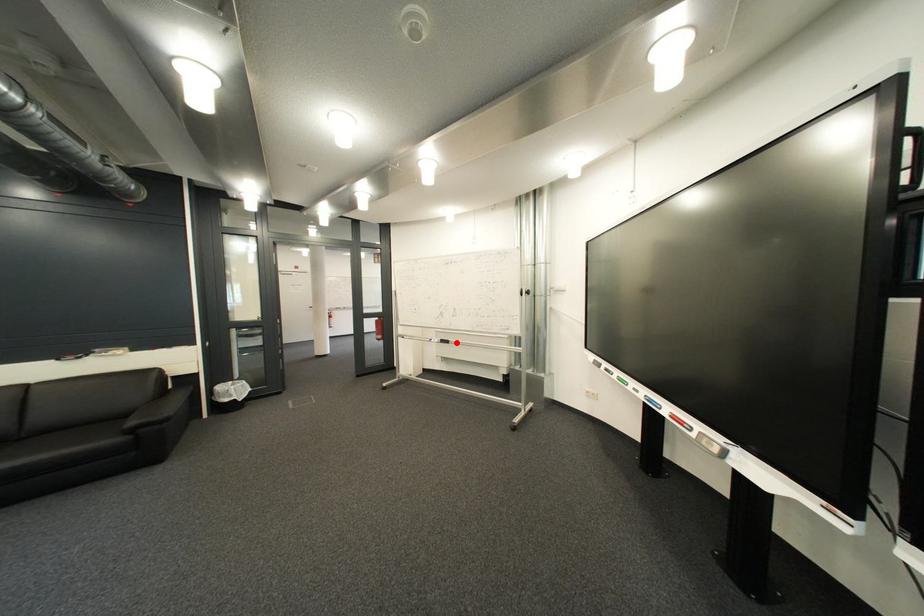
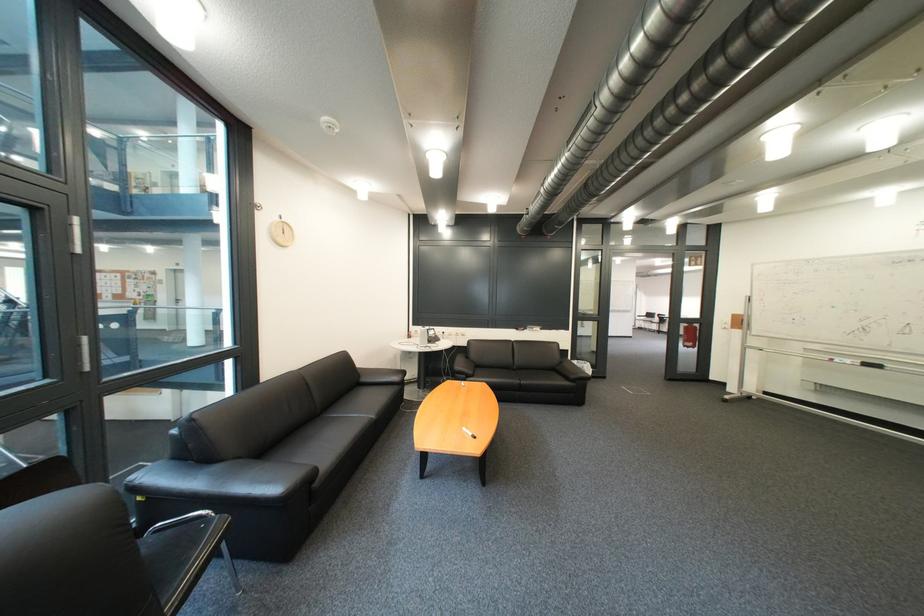
The point at the highlighted location is marked in the first image. Where is the corresponding point in the second image?

(881, 366)